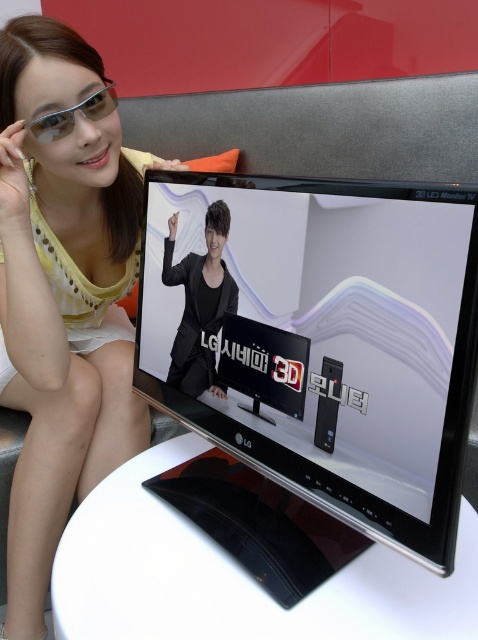
You are a fashion designer observing the scene. You need to determine which item of clothing takes up more visual space in the image. Which one is larger between the matte yellow dress at upper left and the black matte jacket at center?

The matte yellow dress at upper left is larger in size than the black matte jacket at center, so the matte yellow dress at upper left takes up more visual space in the image.

You are a delivery person who needs to place a large rectangular package on the surface that can support its weight. The package is too heavy to lift, so you must choose between the white glossy table at center and the black matte jacket at center. Which object should you choose?

The white glossy table at center has a larger size compared to the black matte jacket at center, so it is more likely to support the heavy package.